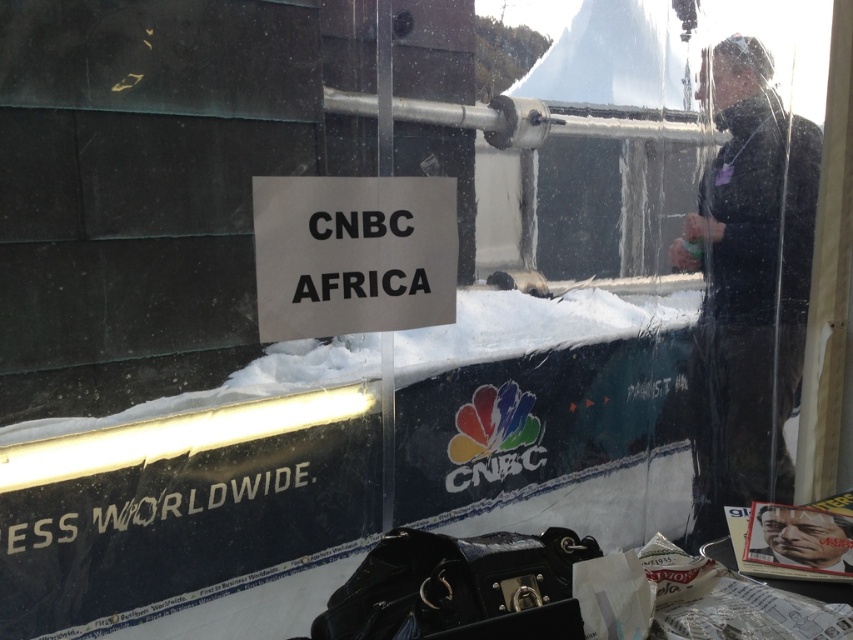
You are standing in front of the glass enclosure and want to read the text on the black paper sign at center and the smooth plastic face at lower right. Which object is higher up in your line of sight?

The black paper sign at center is above the smooth plastic face at lower right, so it is higher up in your line of sight.

Consider the image. You are a photographer trying to capture the CNBC AFRICA sign clearly. You notice the transparent plastic at upper right and the black matte jacket at right in your shot. Which object should you adjust to avoid blocking the sign?

You should adjust the transparent plastic at upper right because it is closer to the viewer than the black matte jacket at right and might be obstructing the view of the CNBC AFRICA sign.